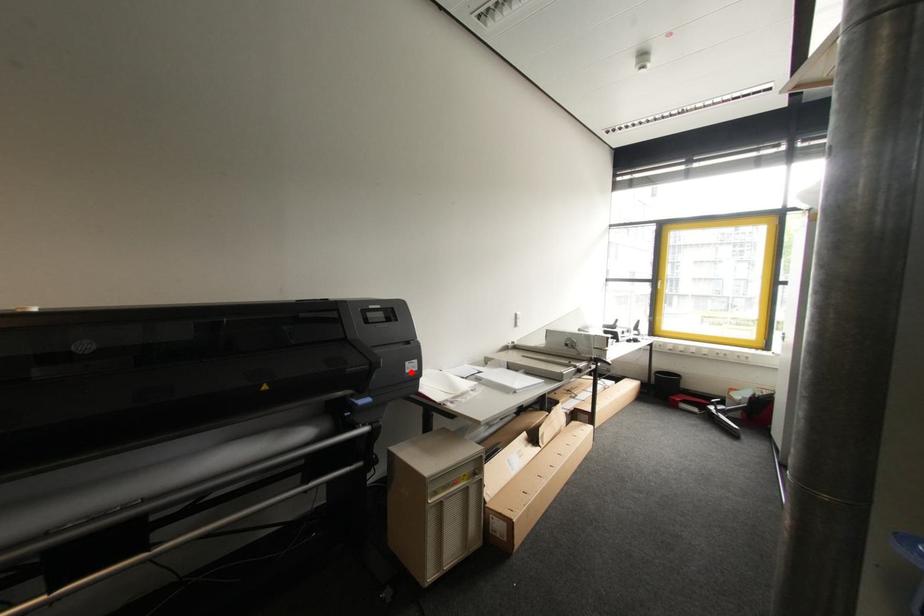
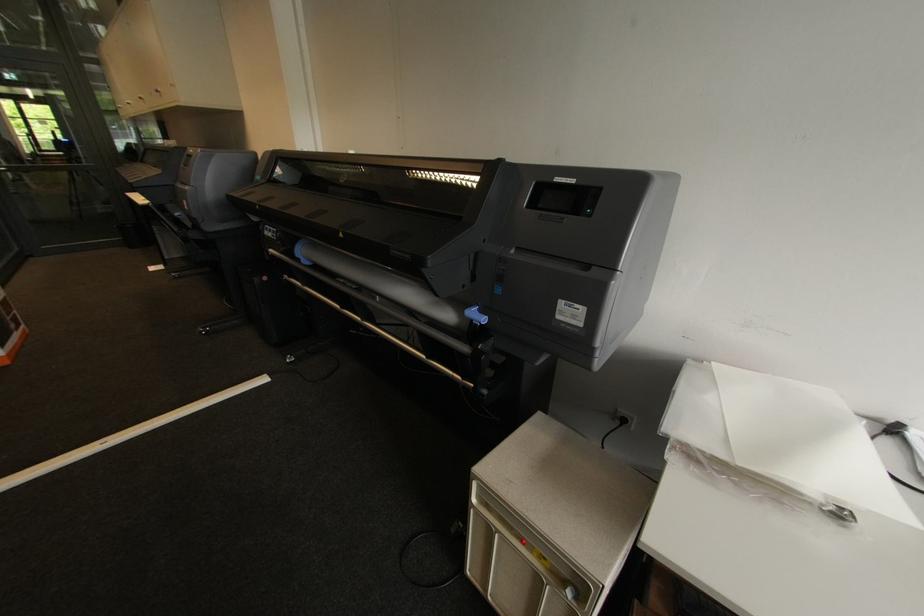
The point at the highlighted location is marked in the first image. Where is the corresponding point in the second image?

(563, 318)